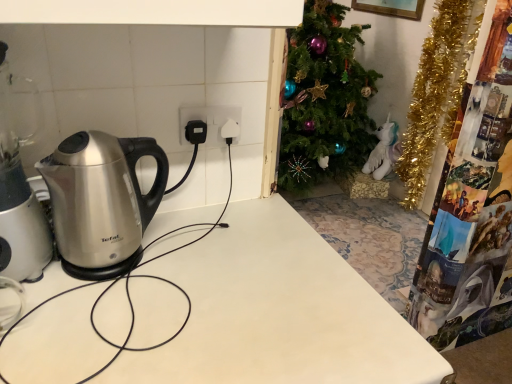
What do you see at coordinates (277, 312) in the screenshot? This screenshot has width=512, height=384. I see `white glossy table at center` at bounding box center [277, 312].

I want to click on satin silver kettle at left, so click(x=18, y=202).

Describe the element at coordinates (18, 202) in the screenshot. I see `satin silver kettle at left` at that location.

The image size is (512, 384). In order to click on white plastic socket at center in this screenshot , I will do `click(209, 121)`.

Does satin silver kettle at left appear on the left side of white plastic socket at center?

Yes, satin silver kettle at left is to the left of white plastic socket at center.

Is satin silver kettle at left not inside white plastic socket at center?

Absolutely, satin silver kettle at left is external to white plastic socket at center.

From the image's perspective, is satin silver kettle at left above white plastic socket at center?

Incorrect, from the image's perspective, satin silver kettle at left is lower than white plastic socket at center.

From the image's perspective, which is above, satin silver kettle at left or white glossy table at center?

satin silver kettle at left.

Can you confirm if satin silver kettle at left is shorter than white glossy table at center?

No.

Can you tell me how much satin silver kettle at left and white glossy table at center differ in facing direction?

The angle between the facing direction of satin silver kettle at left and the facing direction of white glossy table at center is 2.25 degrees.

Would you consider satin silver kettle at left to be distant from white glossy table at center?

No, satin silver kettle at left is not far away from white glossy table at center.

From a real-world perspective, is white glossy table at center physically located above or below satin silver kettle at left?

white glossy table at center is below satin silver kettle at left.

Which point is more forward, (290, 217) or (34, 243)?

The point (34, 243) is closer.

Which object is closer to the camera, white glossy table at center or satin silver kettle at left?

white glossy table at center.

The height and width of the screenshot is (384, 512). I want to click on appliance on the left of white glossy table at center, so click(18, 202).

Considering the points (212, 112) and (366, 366), which point is in front, point (212, 112) or point (366, 366)?

The point (366, 366) is closer to the camera.

Who is bigger, white plastic socket at center or white glossy table at center?

white glossy table at center.

Is white plastic socket at center facing away from white glossy table at center?

No, white plastic socket at center's orientation is not away from white glossy table at center.

Which object is further away from the camera taking this photo, white plastic socket at center or white glossy table at center?

white plastic socket at center is more distant.

Consider the image. Which point is more distant from viewer, (106,381) or (185,143)?

The point (185,143) is more distant.

In the scene shown: From the image's perspective, which is below, white glossy table at center or white plastic socket at center?

From the image's view, white glossy table at center is below.

From a real-world perspective, between white glossy table at center and white plastic socket at center, who is vertically lower?

white glossy table at center, from a real-world perspective.

Based on their positions, is white plastic socket at center located to the left or right of satin silver kettle at left?

white plastic socket at center is to the right of satin silver kettle at left.

Based on their sizes in the image, would you say white plastic socket at center is bigger or smaller than satin silver kettle at left?

white plastic socket at center is smaller than satin silver kettle at left.

Does white plastic socket at center come in front of satin silver kettle at left?

No, the depth of white plastic socket at center is greater than that of satin silver kettle at left.

Consider the image. Is white plastic socket at center turned away from satin silver kettle at left?

That's not correct — white plastic socket at center is not looking away from satin silver kettle at left.

Locate an element on the screen. This screenshot has height=384, width=512. electric outlet behind the satin silver kettle at left is located at coordinates (209, 121).

This screenshot has height=384, width=512. In order to click on table in front of the satin silver kettle at left in this screenshot , I will do (277, 312).

From the image, which object appears to be farther from white plastic socket at center, white glossy table at center or satin silver kettle at left?

white glossy table at center is positioned further to the anchor white plastic socket at center.

From the image, which object appears to be farther from satin silver kettle at left, white glossy table at center or white plastic socket at center?

The object further to satin silver kettle at left is white plastic socket at center.

From the picture: Looking at the image, which one is located further to white glossy table at center, satin silver kettle at left or white plastic socket at center?

The object further to white glossy table at center is white plastic socket at center.

When comparing their distances from satin silver kettle at left, does white plastic socket at center or white glossy table at center seem closer?

The object closer to satin silver kettle at left is white glossy table at center.

Which object lies nearer to the anchor point white plastic socket at center, satin silver kettle at left or white glossy table at center?

Among the two, satin silver kettle at left is located nearer to white plastic socket at center.

Considering their positions, is white plastic socket at center positioned further to white glossy table at center than satin silver kettle at left?

Based on the image, white plastic socket at center appears to be further to white glossy table at center.

The width and height of the screenshot is (512, 384). What are the coordinates of `appliance located between white glossy table at center and white plastic socket at center in the depth direction` in the screenshot? It's located at [x=18, y=202].